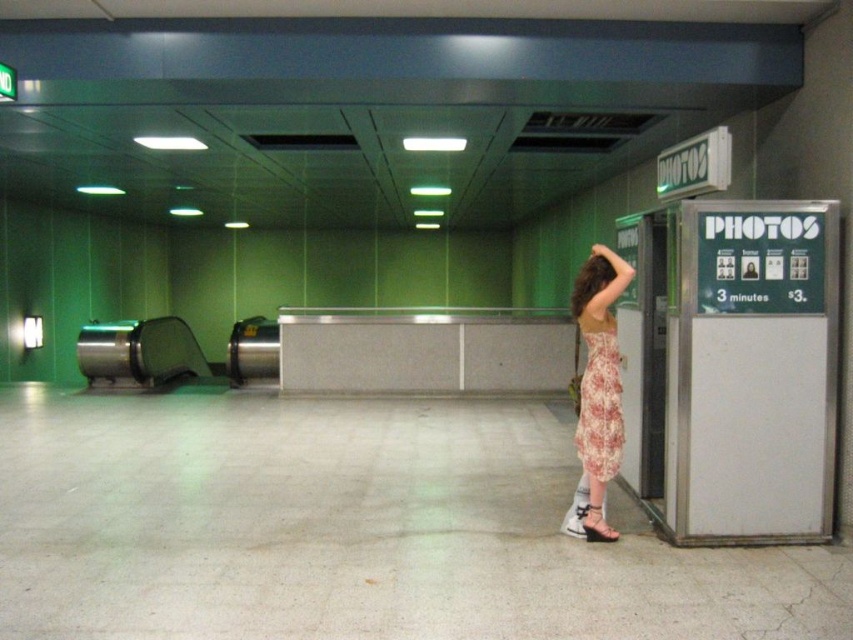
Who is taller, floral dress at right or floral print fabric dress at right?

With more height is floral dress at right.

Between point (607, 316) and point (595, 353), which one is positioned in front?

Point (595, 353) is in front.

Is point (596, 435) positioned after point (585, 346)?

That is False.

Where is `floral dress at right`? The height and width of the screenshot is (640, 853). floral dress at right is located at coordinates (596, 392).

At what (x,y) coordinates should I click in order to perform the action: click on floral dress at right. Please return your answer as a coordinate pair (x, y). Looking at the image, I should click on (596, 392).

Does floral dress at right have a smaller size compared to white leather sandal at lower right?

Actually, floral dress at right might be larger than white leather sandal at lower right.

Is point (607, 372) positioned in front of point (590, 518)?

Yes, it is.

Locate an element on the screen. The image size is (853, 640). floral dress at right is located at coordinates (596, 392).

Is floral print fabric dress at right positioned before white leather sandal at lower right?

Yes.

This screenshot has height=640, width=853. Identify the location of floral print fabric dress at right. pyautogui.click(x=599, y=401).

Is point (601, 474) farther from viewer compared to point (587, 534)?

No, (601, 474) is closer to viewer.

Where is `floral print fabric dress at right`? The height and width of the screenshot is (640, 853). floral print fabric dress at right is located at coordinates (599, 401).